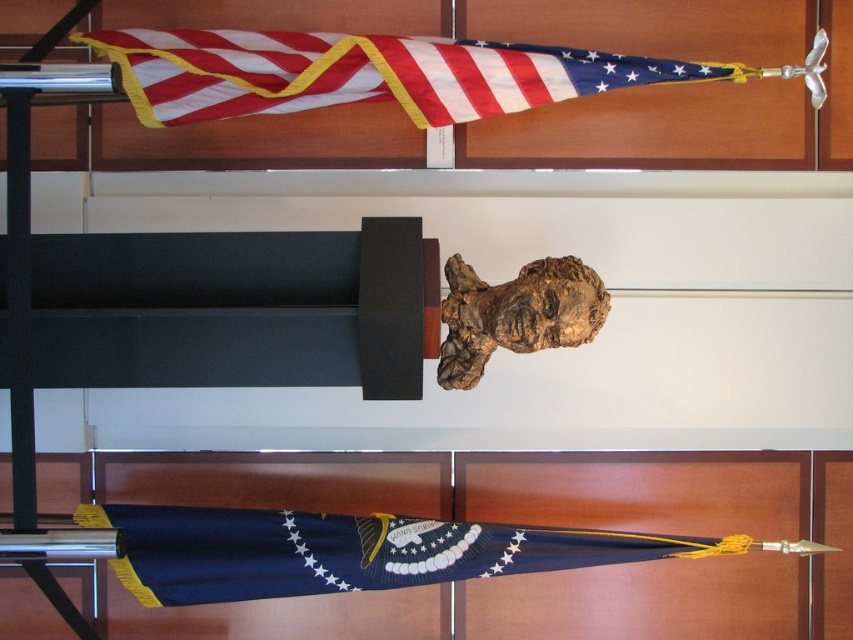
You are standing in front of the image and want to touch both points, point (144, 51) and point (340, 518). Which point should you reach for first to touch the one closer to you?

You should reach for point (144, 51) first because it is closer to you than point (340, 518).

You are an interior designer planning to hang a new painting that is 1.5 meters wide. The painting must be placed between the american flag at upper center and the navy blue fabric at lower center. Considering their widths, will the painting fit horizontally between them?

The american flag at upper center is narrower than the navy blue fabric at lower center. Since the painting is 1.5 meters wide, and the navy blue fabric at lower center is wider, there should be sufficient horizontal space between them to accommodate the painting.